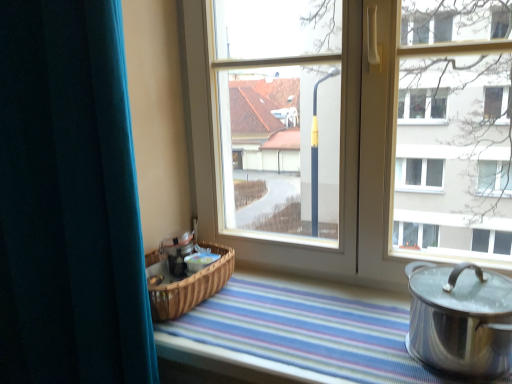
Question: Should I look upward or downward to see teal velvet curtain at left?

Choices:
 (A) down
 (B) up

Answer: (A)

Question: Can you confirm if polished silver pot at lower right is thinner than transparent glass window at center?

Choices:
 (A) no
 (B) yes

Answer: (A)

Question: Would you say polished silver pot at lower right is a long distance from transparent glass window at center?

Choices:
 (A) yes
 (B) no

Answer: (B)

Question: Could you tell me if polished silver pot at lower right is turned towards transparent glass window at center?

Choices:
 (A) no
 (B) yes

Answer: (A)

Question: Would you say polished silver pot at lower right is outside transparent glass window at center?

Choices:
 (A) no
 (B) yes

Answer: (B)

Question: From a real-world perspective, is polished silver pot at lower right beneath transparent glass window at center?

Choices:
 (A) no
 (B) yes

Answer: (B)

Question: Is polished silver pot at lower right turned away from transparent glass window at center?

Choices:
 (A) no
 (B) yes

Answer: (B)

Question: Is transparent glass window at center taller than teal velvet curtain at left?

Choices:
 (A) no
 (B) yes

Answer: (A)

Question: Is transparent glass window at center directly adjacent to teal velvet curtain at left?

Choices:
 (A) no
 (B) yes

Answer: (A)

Question: Does transparent glass window at center have a larger size compared to teal velvet curtain at left?

Choices:
 (A) no
 (B) yes

Answer: (A)

Question: Is transparent glass window at center to the right of teal velvet curtain at left from the viewer's perspective?

Choices:
 (A) no
 (B) yes

Answer: (B)

Question: Can you confirm if transparent glass window at center is positioned to the left of teal velvet curtain at left?

Choices:
 (A) no
 (B) yes

Answer: (A)

Question: Is transparent glass window at center far away from teal velvet curtain at left?

Choices:
 (A) no
 (B) yes

Answer: (A)

Question: Considering the relative sizes of teal velvet curtain at left and polished silver pot at lower right in the image provided, is teal velvet curtain at left shorter than polished silver pot at lower right?

Choices:
 (A) yes
 (B) no

Answer: (B)